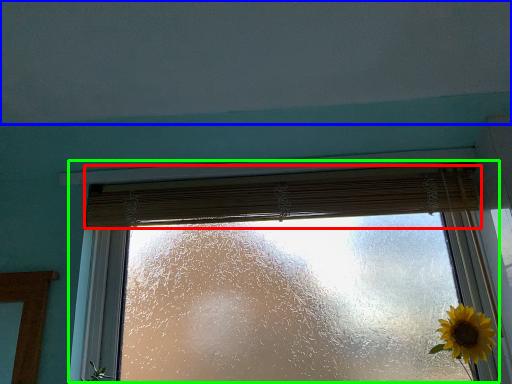
Question: Which object is the closest to the curtain (highlighted by a red box)? Choose among these: backdrop (highlighted by a blue box) or window (highlighted by a green box).

Choices:
 (A) backdrop
 (B) window

Answer: (B)